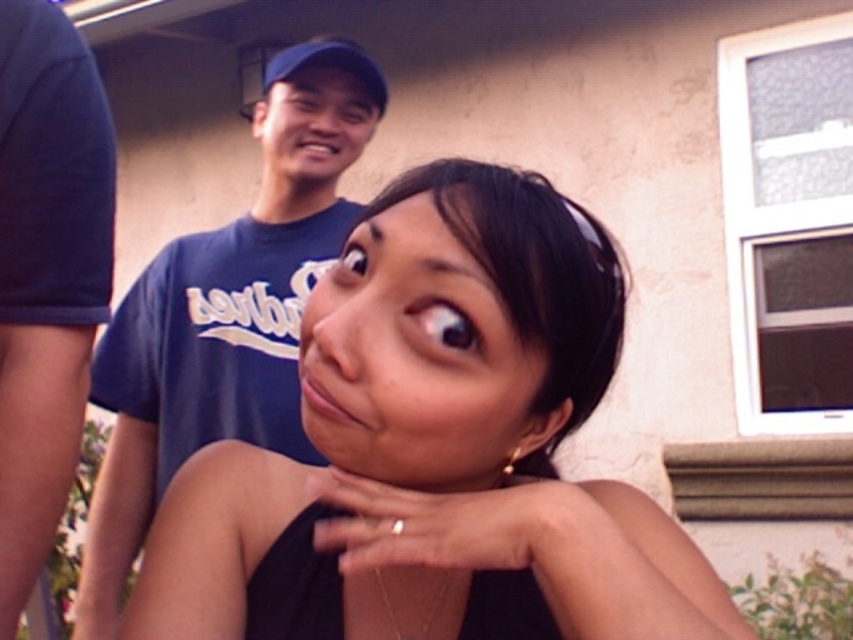
Between point (264, 300) and point (26, 150), which one is positioned behind?

The point (264, 300) is more distant.

Where is `blue cotton t-shirt at upper center`? blue cotton t-shirt at upper center is located at coordinates tap(225, 314).

The image size is (853, 640). Find the location of `blue cotton t-shirt at upper center`. blue cotton t-shirt at upper center is located at coordinates (225, 314).

Can you confirm if blue cotton t-shirt at upper center is taller than smooth skin face at center?

Yes, blue cotton t-shirt at upper center is taller than smooth skin face at center.

Who is lower down, blue cotton t-shirt at upper center or smooth skin face at center?

smooth skin face at center

You are a GUI agent. You are given a task and a screenshot of the screen. Output one action in this format:
    pyautogui.click(x=<x>, y=<y>)
    Task: Click on the blue cotton t-shirt at upper center
    This screenshot has height=640, width=853.
    Given the screenshot: What is the action you would take?
    pyautogui.click(x=225, y=314)

The height and width of the screenshot is (640, 853). What are the coordinates of `blue cotton t-shirt at upper center` in the screenshot? It's located at (225, 314).

Who is lower down, matte black tank top at center or matte blue cap at upper center?

matte black tank top at center

Is point (582, 508) positioned before point (364, 141)?

Yes, point (582, 508) is closer to viewer.

Who is more distant from viewer, (585, 500) or (358, 145)?

Positioned behind is point (358, 145).

I want to click on matte black tank top at center, so click(434, 449).